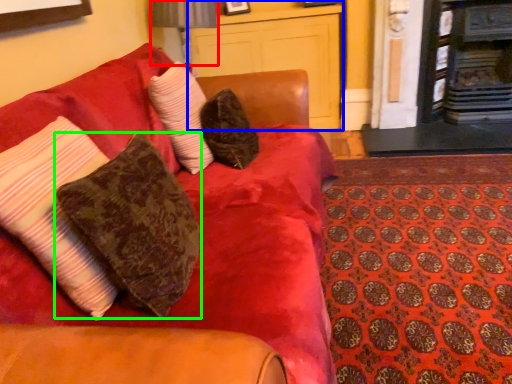
Question: Estimate the real-world distances between objects in this image. Which object is farther from table lamp (highlighted by a red box), dresser (highlighted by a blue box) or pillow (highlighted by a green box)?

Choices:
 (A) dresser
 (B) pillow

Answer: (B)